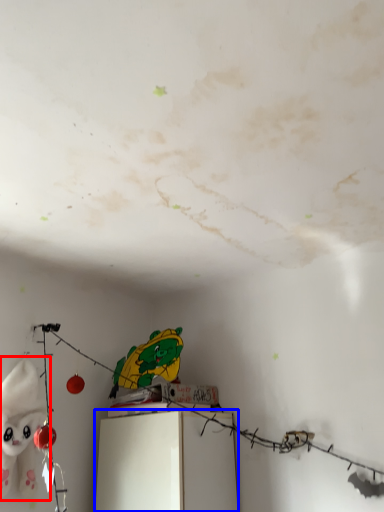
Question: Among these objects, which one is farthest to the camera, toy (highlighted by a red box) or furniture (highlighted by a blue box)?

Choices:
 (A) toy
 (B) furniture

Answer: (B)